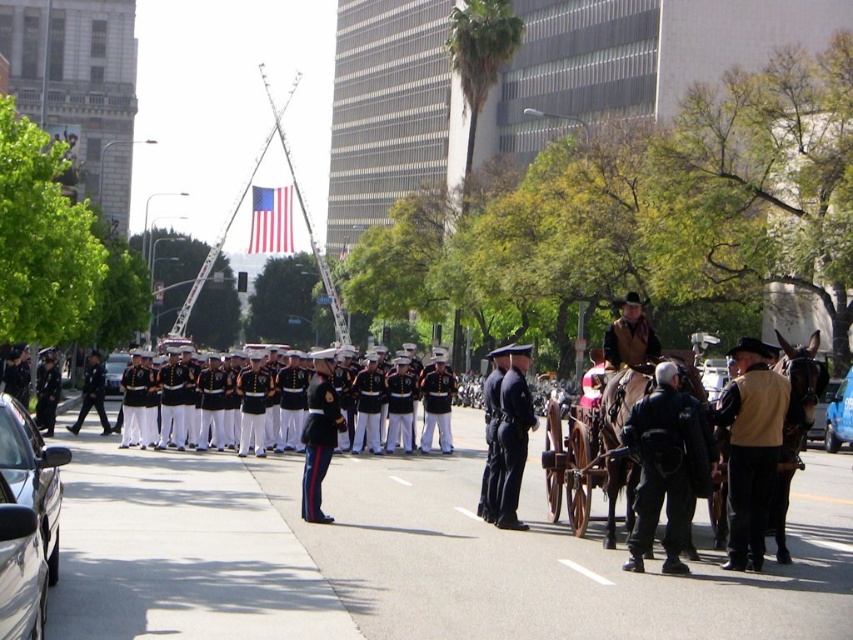
Question: Where is tan leather jacket at center located in relation to silver metallic sedan at center in the image?

Choices:
 (A) left
 (B) right

Answer: (B)

Question: Among these points, which one is nearest to the camera?

Choices:
 (A) (728, 534)
 (B) (473, 515)

Answer: (A)

Question: Does shiny black car at lower left have a greater width compared to white rubber line at center?

Choices:
 (A) yes
 (B) no

Answer: (A)

Question: In this image, where is american flag at center located relative to black uniform at center?

Choices:
 (A) below
 (B) above

Answer: (B)

Question: Which point is closer to the camera taking this photo?

Choices:
 (A) (506, 486)
 (B) (265, 221)

Answer: (A)

Question: Based on their relative distances, which object is farther from the american flag at center?

Choices:
 (A) shiny black uniform at center
 (B) black uniform at center

Answer: (A)